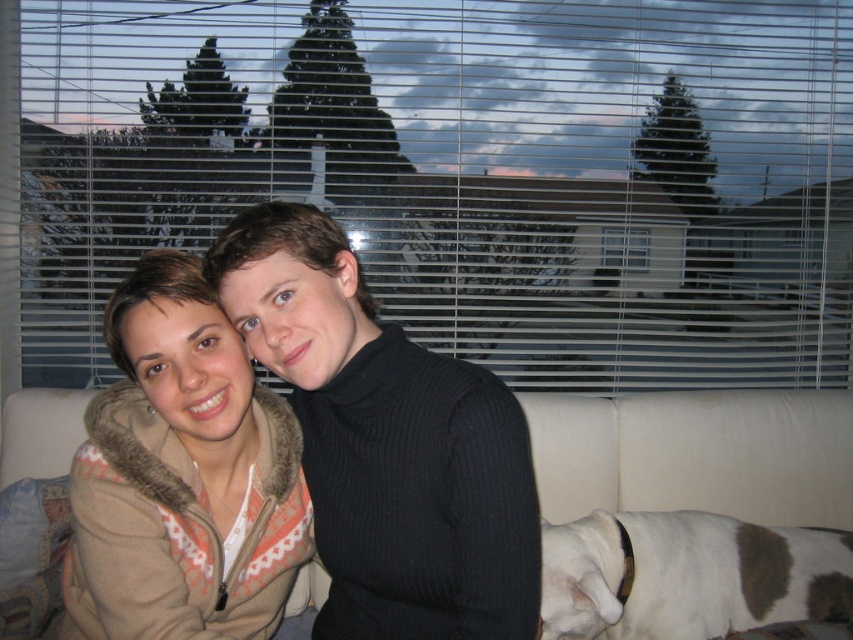
Who is lower down, beige fleece jacket at center or white fur at lower right?

white fur at lower right is lower down.

Who is higher up, beige fleece jacket at center or white fur at lower right?

beige fleece jacket at center is above.

Which is in front, point (169, 529) or point (735, 573)?

Positioned in front is point (169, 529).

This screenshot has width=853, height=640. I want to click on beige fleece jacket at center, so click(183, 476).

Looking at this image, does transparent plastic blinds at upper center have a greater height compared to camouflage fleece jacket at center?

Indeed, transparent plastic blinds at upper center has a greater height compared to camouflage fleece jacket at center.

Between point (134, 83) and point (498, 531), which one is positioned behind?

Point (134, 83)

You are a GUI agent. You are given a task and a screenshot of the screen. Output one action in this format:
    pyautogui.click(x=<x>, y=<y>)
    Task: Click on the transparent plastic blinds at upper center
    
    Given the screenshot: What is the action you would take?
    pyautogui.click(x=454, y=173)

Where is `transparent plastic blinds at upper center`? Image resolution: width=853 pixels, height=640 pixels. transparent plastic blinds at upper center is located at coordinates (454, 173).

Can you confirm if camouflage fleece jacket at center is taller than beige fabric couch at center?

Correct, camouflage fleece jacket at center is much taller as beige fabric couch at center.

Which is above, camouflage fleece jacket at center or beige fabric couch at center?

camouflage fleece jacket at center is higher up.

The height and width of the screenshot is (640, 853). Identify the location of camouflage fleece jacket at center. (387, 442).